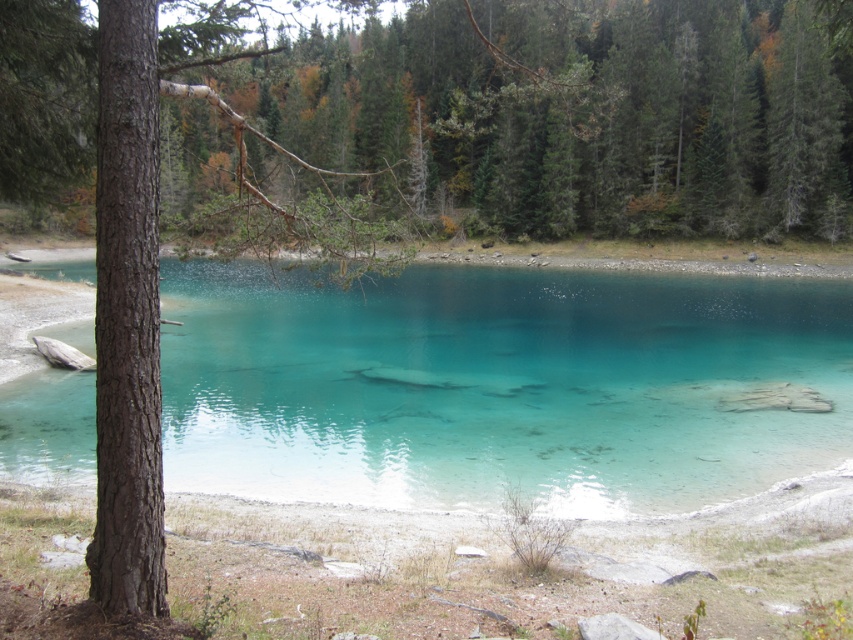
Question: Which of the following is the closest to the observer?

Choices:
 (A) clear glassy water at center
 (B) green matte tree at upper center

Answer: (B)

Question: Is clear glassy water at center below green matte tree at upper center?

Choices:
 (A) yes
 (B) no

Answer: (A)

Question: Among these points, which one is nearest to the camera?

Choices:
 (A) (844, 189)
 (B) (311, 292)

Answer: (B)

Question: Is clear glassy water at center below green matte tree at upper center?

Choices:
 (A) no
 (B) yes

Answer: (B)

Question: Does clear glassy water at center appear over green matte tree at upper center?

Choices:
 (A) no
 (B) yes

Answer: (A)